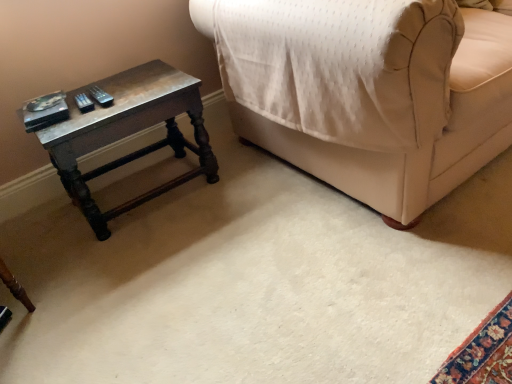
Question: Should I look upward or downward to see wooden table at left?

Choices:
 (A) down
 (B) up

Answer: (B)

Question: Can you confirm if beige fabric couch at upper right is wider than wooden table at left?

Choices:
 (A) yes
 (B) no

Answer: (A)

Question: Is beige fabric couch at upper right to the left of wooden table at left from the viewer's perspective?

Choices:
 (A) yes
 (B) no

Answer: (B)

Question: Is beige fabric couch at upper right in front of wooden table at left?

Choices:
 (A) no
 (B) yes

Answer: (B)

Question: Is wooden table at left surrounded by beige fabric couch at upper right?

Choices:
 (A) no
 (B) yes

Answer: (A)

Question: From the image's perspective, would you say beige fabric couch at upper right is shown under wooden table at left?

Choices:
 (A) no
 (B) yes

Answer: (A)

Question: Is beige fabric couch at upper right directly adjacent to wooden table at left?

Choices:
 (A) yes
 (B) no

Answer: (B)

Question: Considering the relative sizes of wooden table at left and beige fabric couch at upper right in the image provided, is wooden table at left smaller than beige fabric couch at upper right?

Choices:
 (A) yes
 (B) no

Answer: (A)

Question: Is wooden table at left positioned before beige fabric couch at upper right?

Choices:
 (A) no
 (B) yes

Answer: (A)

Question: Is wooden table at left far away from beige fabric couch at upper right?

Choices:
 (A) no
 (B) yes

Answer: (A)

Question: Could you tell me if wooden table at left is turned towards beige fabric couch at upper right?

Choices:
 (A) yes
 (B) no

Answer: (B)

Question: Can you confirm if wooden table at left is positioned to the right of beige fabric couch at upper right?

Choices:
 (A) yes
 (B) no

Answer: (B)

Question: Can you confirm if wooden table at left is bigger than beige fabric couch at upper right?

Choices:
 (A) no
 (B) yes

Answer: (A)

Question: Considering their positions, is wooden table at left located in front of or behind beige fabric couch at upper right?

Choices:
 (A) front
 (B) behind

Answer: (B)